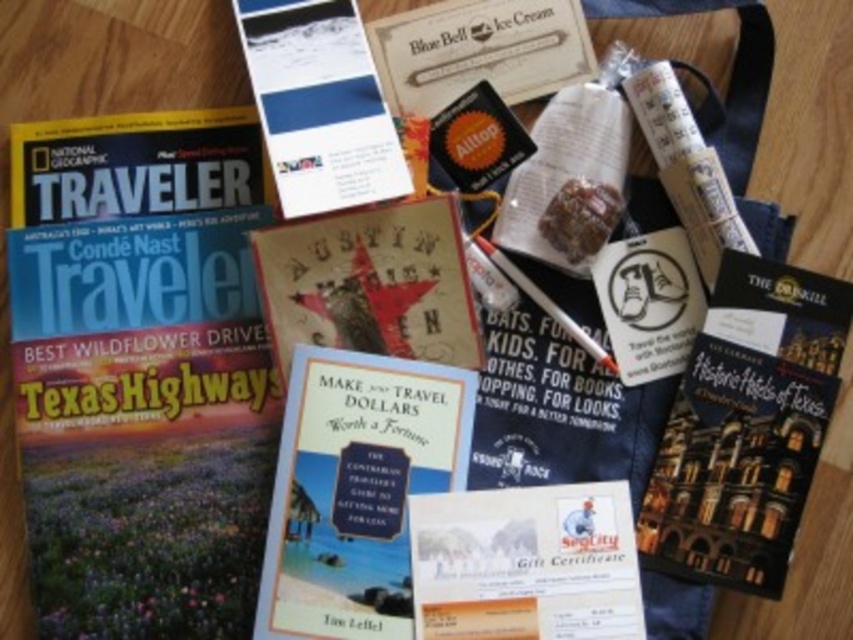
Does hardcover book at center have a larger size compared to white paper gift certificate at center?

Indeed, hardcover book at center has a larger size compared to white paper gift certificate at center.

This screenshot has height=640, width=853. What do you see at coordinates (357, 490) in the screenshot? I see `hardcover book at center` at bounding box center [357, 490].

Is point (309, 468) closer to camera compared to point (457, 506)?

Yes, point (309, 468) is in front of point (457, 506).

At what (x,y) coordinates should I click in order to perform the action: click on hardcover book at center. Please return your answer as a coordinate pair (x, y). The image size is (853, 640). Looking at the image, I should click on (357, 490).

Does hardcover book at center appear on the right side of white matte pen at center?

Incorrect, hardcover book at center is not on the right side of white matte pen at center.

Between hardcover book at center and white matte pen at center, which one appears on the left side from the viewer's perspective?

hardcover book at center

Find the location of `hardcover book at center`. hardcover book at center is located at coordinates (357, 490).

Identify the location of hardcover book at center. (357, 490).

Which is more to the right, white paper gift certificate at center or matte paper brochure at upper center?

Positioned to the right is white paper gift certificate at center.

Can you confirm if white paper gift certificate at center is positioned to the left of matte paper brochure at upper center?

No, white paper gift certificate at center is not to the left of matte paper brochure at upper center.

Is point (553, 492) farther from viewer compared to point (292, 54)?

No, (553, 492) is in front of (292, 54).

Find the location of a particular element. The width and height of the screenshot is (853, 640). white paper gift certificate at center is located at coordinates (525, 563).